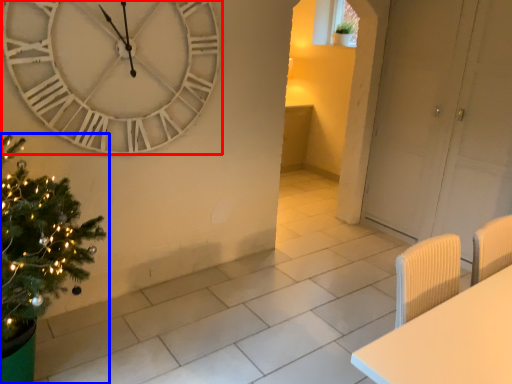
Question: Which of the following is the closest to the observer, wall clock (highlighted by a red box) or christmas tree (highlighted by a blue box)?

Choices:
 (A) wall clock
 (B) christmas tree

Answer: (B)